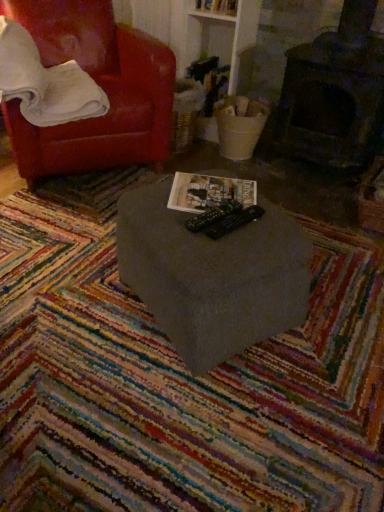
The width and height of the screenshot is (384, 512). Identify the location of vacant area on top of multicolored woven mat at center (from a real-world perspective). (177, 354).